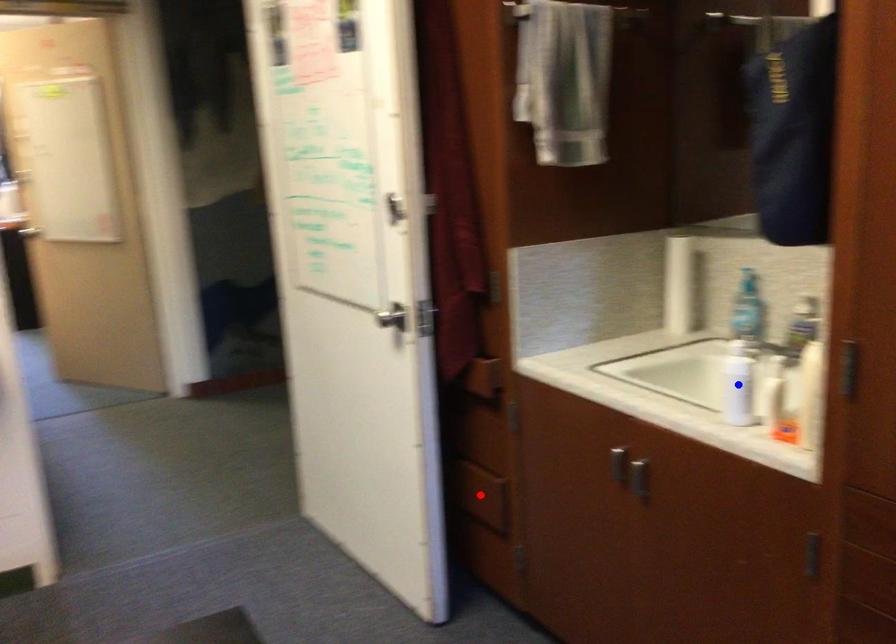
Question: Two points are marked on the image. Which point is closer to the camera?

Choices:
 (A) Blue point is closer.
 (B) Red point is closer.

Answer: (A)